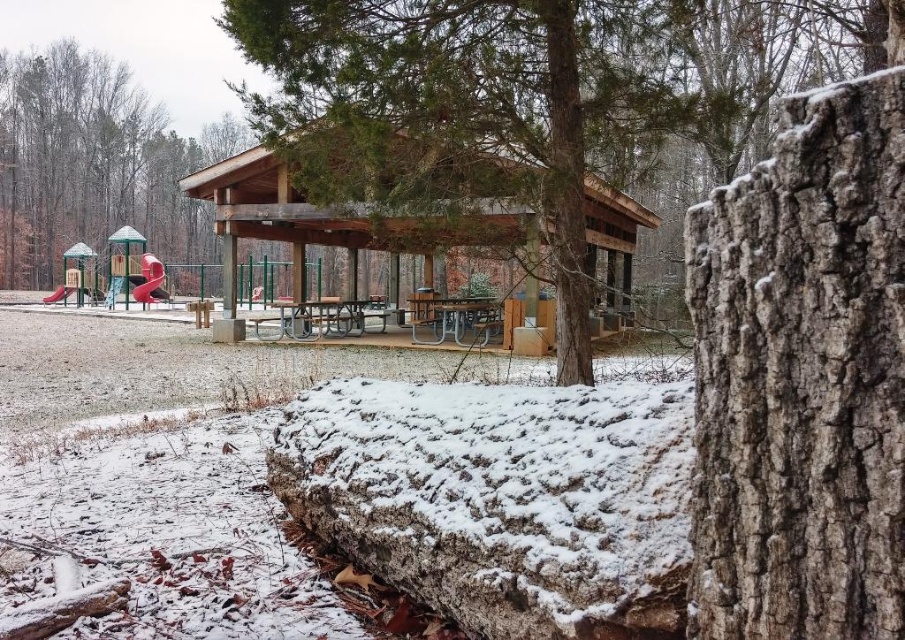
You are a hiker who wants to take a photo of the metallic silver picnic table at center without the brown rough bark tree at center blocking it. Can you move to a position where the tree is not in front of the picnic table?

The brown rough bark tree at center is in front of the metallic silver picnic table at center, so you cannot move to a position where the tree is not blocking the picnic table. You would need to move around the tree or take the photo from a different angle where the tree is not between you and the picnic table.

You are standing at the center of the park and see the point marked at point (94,164). Which object is this point located on?

The point (94,164) is located on the smooth bark tree at upper left.